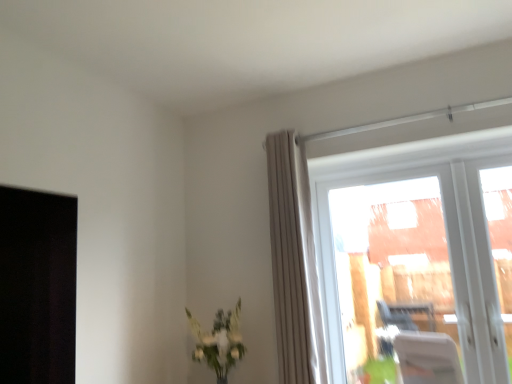
Where is `green leafy plant at lower center`? green leafy plant at lower center is located at coordinates (219, 342).

The image size is (512, 384). In order to click on beige textured curtain at upper right in this screenshot , I will do `click(294, 263)`.

Is beige textured curtain at upper right facing towards transparent glass window at upper right?

No, beige textured curtain at upper right is not aimed at transparent glass window at upper right.

Can you confirm if beige textured curtain at upper right is wider than transparent glass window at upper right?

Correct, the width of beige textured curtain at upper right exceeds that of transparent glass window at upper right.

Is beige textured curtain at upper right shorter than transparent glass window at upper right?

No, beige textured curtain at upper right is not shorter than transparent glass window at upper right.

From a real-world perspective, is beige textured curtain at upper right positioned above or below transparent glass window at upper right?

Clearly, from a real-world perspective, beige textured curtain at upper right is above transparent glass window at upper right.

Which point is more forward, [442,208] or [288,329]?

Point [288,329]

Measure the distance from transparent glass window at upper right to beige textured curtain at upper right.

23.84 inches.

Considering the relative sizes of transparent glass window at upper right and beige textured curtain at upper right in the image provided, is transparent glass window at upper right shorter than beige textured curtain at upper right?

Yes.

Is transparent glass window at upper right positioned behind beige textured curtain at upper right?

No, transparent glass window at upper right is in front of beige textured curtain at upper right.

Considering the relative sizes of green leafy plant at lower center and beige textured curtain at upper right in the image provided, is green leafy plant at lower center bigger than beige textured curtain at upper right?

No, green leafy plant at lower center is not bigger than beige textured curtain at upper right.

Locate an element on the screen. This screenshot has width=512, height=384. curtain that appears in front of the green leafy plant at lower center is located at coordinates (294, 263).

Can you confirm if green leafy plant at lower center is shorter than beige textured curtain at upper right?

Yes, green leafy plant at lower center is shorter than beige textured curtain at upper right.

Is point (218, 338) more distant than point (275, 306)?

Yes, point (218, 338) is behind point (275, 306).

How different are the orientations of transparent glass window at upper right and green leafy plant at lower center in degrees?

There is a 53-degree angle between the facing directions of transparent glass window at upper right and green leafy plant at lower center.

Which point is more forward, (x=397, y=226) or (x=194, y=329)?

The point (x=194, y=329) is more forward.

Between transparent glass window at upper right and green leafy plant at lower center, which one has larger width?

With larger width is green leafy plant at lower center.

From a real-world perspective, does transparent glass window at upper right stand above green leafy plant at lower center?

Yes, from a real-world perspective, transparent glass window at upper right is on top of green leafy plant at lower center.

Is beige textured curtain at upper right outside of green leafy plant at lower center?

Yes, beige textured curtain at upper right is not within green leafy plant at lower center.

Consider the image. Can you confirm if beige textured curtain at upper right is positioned to the left of green leafy plant at lower center?

No.

How many degrees apart are the facing directions of beige textured curtain at upper right and green leafy plant at lower center?

The angular difference between beige textured curtain at upper right and green leafy plant at lower center is 52 degrees.

Between green leafy plant at lower center and transparent glass window at upper right, which one appears on the right side from the viewer's perspective?

Positioned to the right is transparent glass window at upper right.

From a real-world perspective, is green leafy plant at lower center under transparent glass window at upper right?

Yes, from a real-world perspective, green leafy plant at lower center is under transparent glass window at upper right.

Is green leafy plant at lower center outside of transparent glass window at upper right?

green leafy plant at lower center is positioned outside transparent glass window at upper right.

You are a GUI agent. You are given a task and a screenshot of the screen. Output one action in this format:
    pyautogui.click(x=<x>, y=<y>)
    Task: Click on the curtain above the transparent glass window at upper right (from the image's perspective)
    The height and width of the screenshot is (384, 512).
    Given the screenshot: What is the action you would take?
    pyautogui.click(x=294, y=263)

Find the location of a particular element. curtain behind the transparent glass window at upper right is located at coordinates coord(294,263).

From the image, which object appears to be nearer to green leafy plant at lower center, beige textured curtain at upper right or transparent glass window at upper right?

Among the two, beige textured curtain at upper right is located nearer to green leafy plant at lower center.

Estimate the real-world distances between objects in this image. Which object is closer to beige textured curtain at upper right, green leafy plant at lower center or transparent glass window at upper right?

Among the two, green leafy plant at lower center is located nearer to beige textured curtain at upper right.

Estimate the real-world distances between objects in this image. Which object is closer to transparent glass window at upper right, beige textured curtain at upper right or green leafy plant at lower center?

beige textured curtain at upper right lies closer to transparent glass window at upper right than the other object.

Estimate the real-world distances between objects in this image. Which object is further from beige textured curtain at upper right, transparent glass window at upper right or green leafy plant at lower center?

transparent glass window at upper right is further to beige textured curtain at upper right.

From the image, which object appears to be farther from green leafy plant at lower center, transparent glass window at upper right or beige textured curtain at upper right?

The object further to green leafy plant at lower center is transparent glass window at upper right.

Looking at the image, which one is located further to transparent glass window at upper right, green leafy plant at lower center or beige textured curtain at upper right?

Among the two, green leafy plant at lower center is located further to transparent glass window at upper right.

I want to click on curtain located between green leafy plant at lower center and transparent glass window at upper right in the left-right direction, so click(294, 263).